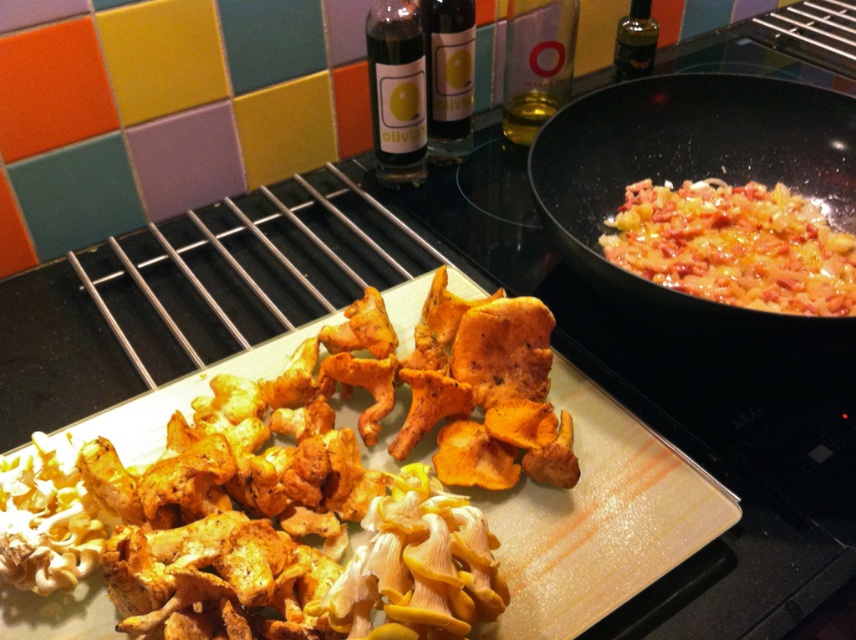
Does black non-stick wok at right appear on the right side of clear glass bottle at upper center?

Yes, black non-stick wok at right is to the right of clear glass bottle at upper center.

Is black non-stick wok at right positioned behind clear glass bottle at upper center?

No.

Does point (745, 180) come in front of point (516, 102)?

That is True.

This screenshot has width=856, height=640. I want to click on black non-stick wok at right, so click(x=691, y=177).

Which of these two, yellowish-brown crispy mushrooms at center or shiny golden pasta at right, stands shorter?

shiny golden pasta at right

Does yellowish-brown crispy mushrooms at center come behind shiny golden pasta at right?

No, it is not.

Describe the element at coordinates (327, 461) in the screenshot. I see `yellowish-brown crispy mushrooms at center` at that location.

Where is `yellowish-brown crispy mushrooms at center`? The image size is (856, 640). yellowish-brown crispy mushrooms at center is located at coordinates (327, 461).

Is clear glass bottle at upper center above transparent plastic bottle at upper right?

Incorrect, clear glass bottle at upper center is not positioned above transparent plastic bottle at upper right.

Is point (528, 48) closer to viewer compared to point (626, 26)?

Yes, it is.

Locate an element on the screen. This screenshot has width=856, height=640. clear glass bottle at upper center is located at coordinates (536, 64).